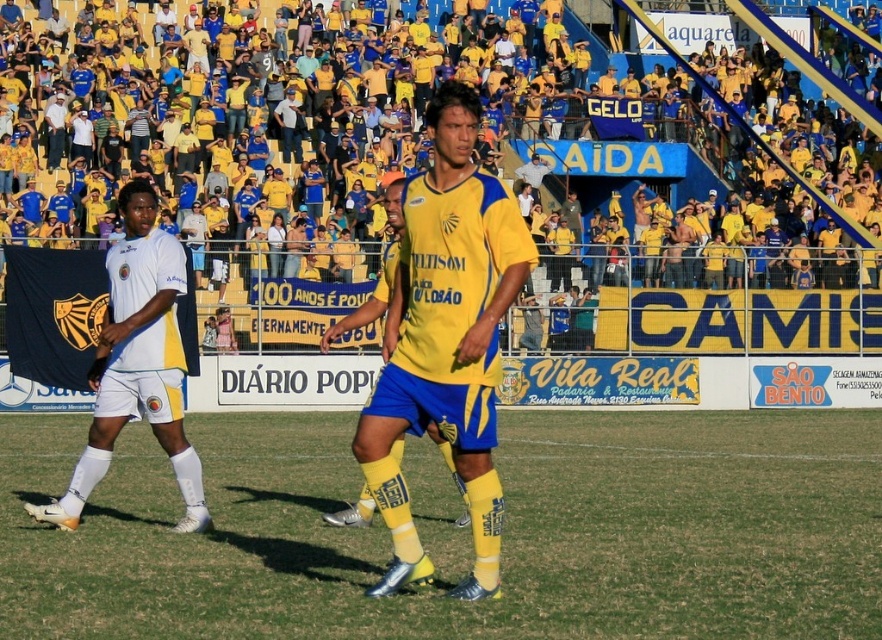
Which of these two, yellow jersey at upper center or green grass at center, stands shorter?

With less height is green grass at center.

Does yellow jersey at upper center appear over green grass at center?

Yes.

Is point (602, 140) positioned before point (123, 467)?

That is False.

Locate an element on the screen. Image resolution: width=882 pixels, height=640 pixels. yellow jersey at upper center is located at coordinates (425, 140).

Does yellow jersey at upper center appear under white matte shorts at left?

No, yellow jersey at upper center is not below white matte shorts at left.

Looking at this image, who is positioned more to the left, yellow jersey at upper center or white matte shorts at left?

From the viewer's perspective, white matte shorts at left appears more on the left side.

Which is behind, point (652, 122) or point (81, 458)?

The point (652, 122) is more distant.

At what (x,y) coordinates should I click in order to perform the action: click on yellow jersey at upper center. Please return your answer as a coordinate pair (x, y). Looking at the image, I should click on (425, 140).

Does point (752, 189) lie in front of point (363, 422)?

No.

Does yellow jersey at upper center lie behind yellow matte jersey at center?

That is True.

Image resolution: width=882 pixels, height=640 pixels. Identify the location of yellow jersey at upper center. (425, 140).